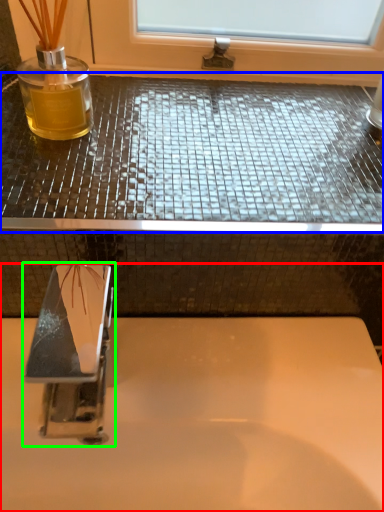
Question: Which is nearer to the sink (highlighted by a red box)? counter top (highlighted by a blue box) or tap (highlighted by a green box).

Choices:
 (A) counter top
 (B) tap

Answer: (B)